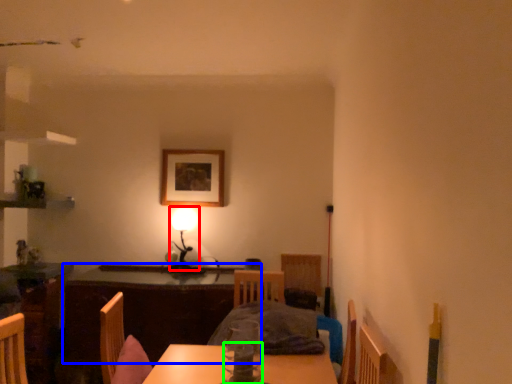
Question: Based on their relative distances, which object is nearer to table lamp (highlighted by a red box)? Choose from table (highlighted by a blue box) and tableware (highlighted by a green box).

Choices:
 (A) table
 (B) tableware

Answer: (A)